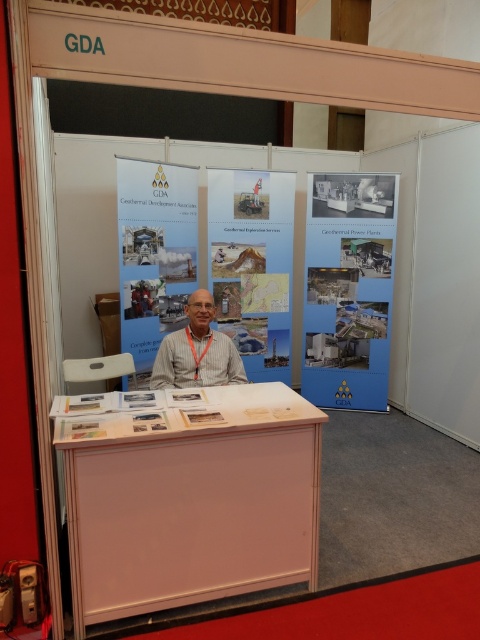
Who is more forward, (229, 193) or (146, 356)?

Positioned in front is point (146, 356).

Who is shorter, blue paperboard at center or white paper at center?

white paper at center is shorter.

Is point (386, 196) behind point (168, 193)?

Yes.

Image resolution: width=480 pixels, height=640 pixels. In order to click on blue paperboard at center in this screenshot , I will do `click(348, 289)`.

Between blue paperboard at center and matte paper poster at center, which one is positioned lower?

Positioned lower is blue paperboard at center.

Is point (389, 202) more distant than point (250, 246)?

Yes, point (389, 202) is farther from viewer.

Does point (321, 378) come closer to viewer compared to point (230, 314)?

That is False.

I want to click on blue paperboard at center, so click(348, 289).

Does blue paper at center lie in front of white paper at center?

That is False.

Which is above, blue paper at center or white paper at center?

white paper at center is above.

This screenshot has width=480, height=640. What are the coordinates of `blue paper at center` in the screenshot? It's located at (348, 291).